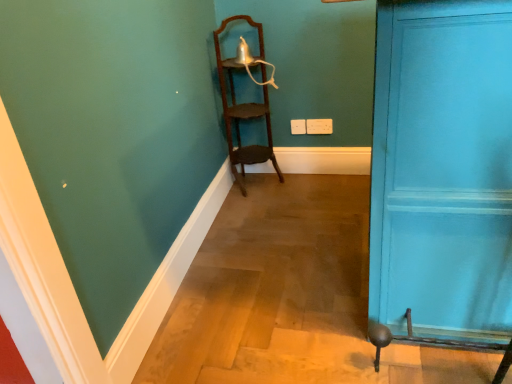
Where is `vacant area in front of wooden shelf at center`? vacant area in front of wooden shelf at center is located at coordinates (265, 204).